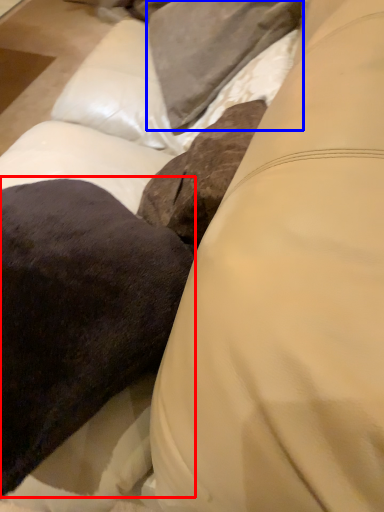
Question: Which point is further to the camera, throw pillow (highlighted by a red box) or pillow (highlighted by a blue box)?

Choices:
 (A) throw pillow
 (B) pillow

Answer: (B)